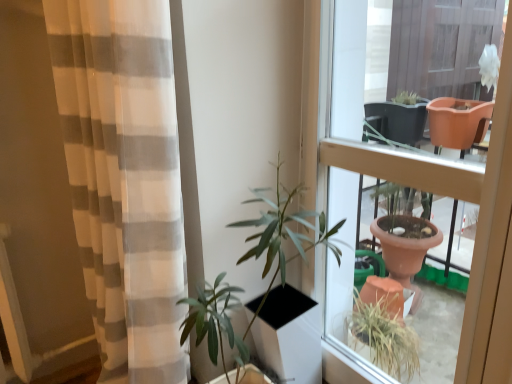
Question: Would you say matte brown pot at center is inside or outside white sheer curtain at left?

Choices:
 (A) outside
 (B) inside

Answer: (A)

Question: Is matte brown pot at center wider or thinner than white sheer curtain at left?

Choices:
 (A) wide
 (B) thin

Answer: (B)

Question: From a real-world perspective, relative to white sheer curtain at left, is matte brown pot at center vertically above or below?

Choices:
 (A) above
 (B) below

Answer: (A)

Question: Is white sheer curtain at left inside or outside of matte brown pot at center?

Choices:
 (A) outside
 (B) inside

Answer: (A)

Question: From their relative heights in the image, would you say white sheer curtain at left is taller or shorter than matte brown pot at center?

Choices:
 (A) short
 (B) tall

Answer: (B)

Question: Considering the positions of point (159, 377) and point (340, 342), is point (159, 377) closer or farther from the camera than point (340, 342)?

Choices:
 (A) farther
 (B) closer

Answer: (B)

Question: From the image's perspective, is white sheer curtain at left located above or below matte brown pot at center?

Choices:
 (A) below
 (B) above

Answer: (A)